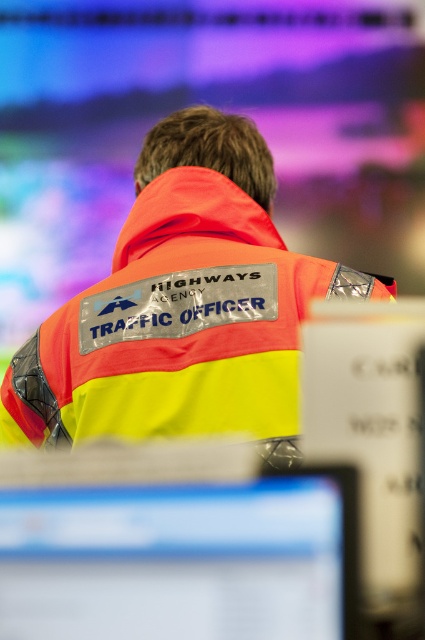
Question: Does orange reflective jacket at center lie behind matte plastic monitor at lower center?

Choices:
 (A) no
 (B) yes

Answer: (B)

Question: Can you confirm if orange reflective jacket at center is bigger than matte plastic monitor at lower center?

Choices:
 (A) yes
 (B) no

Answer: (A)

Question: Which point appears farthest from the camera in this image?

Choices:
 (A) (99, 380)
 (B) (3, 496)

Answer: (A)

Question: Which of the following is the farthest from the observer?

Choices:
 (A) orange reflective jacket at center
 (B) matte plastic monitor at lower center

Answer: (A)

Question: Among these objects, which one is farthest from the camera?

Choices:
 (A) matte plastic monitor at lower center
 (B) orange reflective jacket at center

Answer: (B)

Question: Observing the image, what is the correct spatial positioning of orange reflective jacket at center in reference to matte plastic monitor at lower center?

Choices:
 (A) above
 (B) below

Answer: (A)